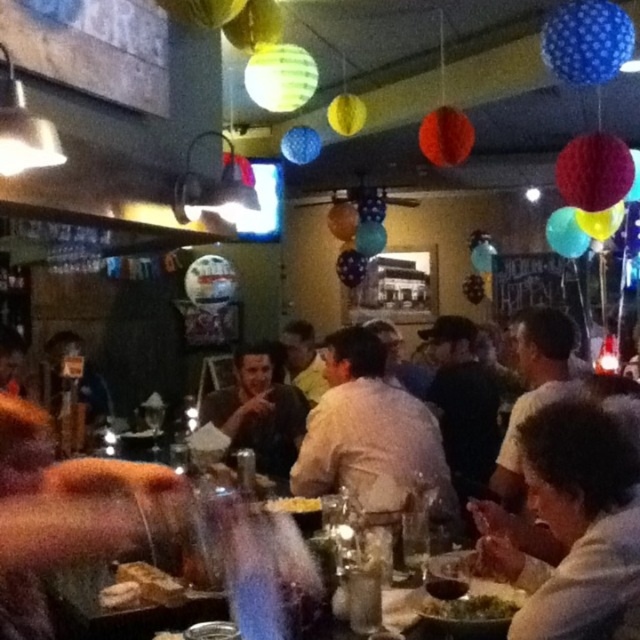
You are a server at the restaurant. You need to deliver a drink to the customer wearing the white cotton shirt at center. However, there is a customer wearing the white matte shirt at lower right blocking your path. Can you walk around them without needing to move the table?

The white matte shirt at lower right is narrower than the white cotton shirt at center, so you can walk around the customer wearing the white matte shirt at lower right without needing to move the table.